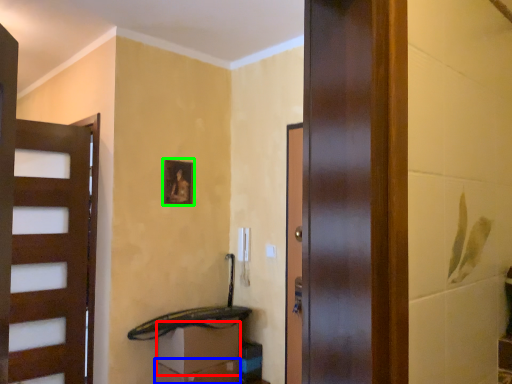
Question: Which object is positioned closest to drawer (highlighted by a red box)? Select from drawer (highlighted by a blue box) and picture frame (highlighted by a green box).

Choices:
 (A) drawer
 (B) picture frame

Answer: (A)